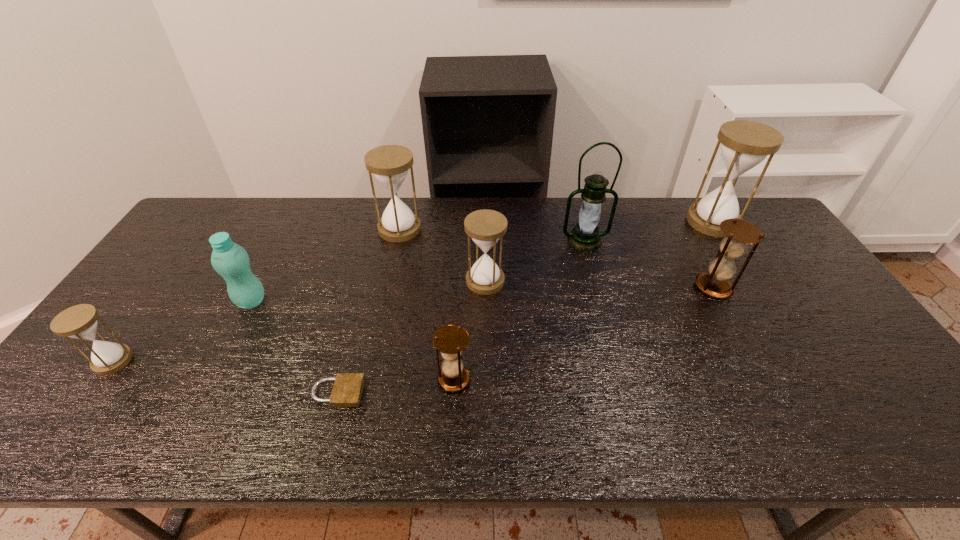
This screenshot has height=540, width=960. Identify the location of green lantern. (585, 236).

Where is `the seventh object from left to right`? This screenshot has height=540, width=960. the seventh object from left to right is located at coordinates (585, 236).

Where is `the rightmost white hourglass`? the rightmost white hourglass is located at coordinates (745, 144).

Where is `the tallest hourglass`? the tallest hourglass is located at coordinates (745, 144).

At what (x,y) coordinates should I click in order to perform the action: click on the third smallest white hourglass. Please return your answer as a coordinate pair (x, y). The image size is (960, 540). Looking at the image, I should click on (389, 163).

Image resolution: width=960 pixels, height=540 pixels. I want to click on the third white hourglass from right to left, so click(389, 163).

You are a GUI agent. You are given a task and a screenshot of the screen. Output one action in this format:
    pyautogui.click(x=<x>, y=<y>)
    Task: Click on the second object from left to right
    This screenshot has height=540, width=960.
    Given the screenshot: What is the action you would take?
    click(x=230, y=260)

I want to click on the second white hourglass from right to left, so click(x=485, y=227).

This screenshot has height=540, width=960. In order to click on the second smallest white hourglass in this screenshot , I will do `click(485, 227)`.

The width and height of the screenshot is (960, 540). Identify the location of the bigger brown hourglass. coord(739,233).